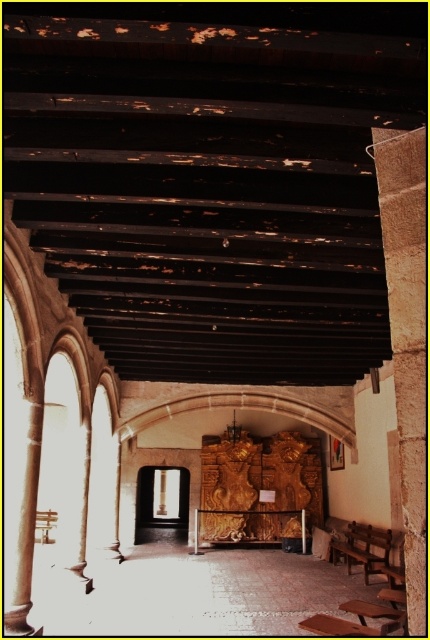
You are a visitor in this historical building and want to sit on the wooden bench at center. Which direction should you walk from the brown stone pillar at right to reach it?

The brown stone pillar at right is positioned on the left side of wooden bench at center, so you should walk to the right from the brown stone pillar at right to reach the wooden bench at center.

You are a visitor standing at the entrance of the historical building. You see two wooden benches. One is the wooden bench at center and the other is the wooden bench at lower right. Which bench is positioned higher in the image?

The wooden bench at center is positioned higher than the wooden bench at lower right.

You are a visitor in this historical building and need to sit down. There are two wooden benches available. The wooden bench at center and the wooden bench at lower right. Which one can accommodate more people?

The wooden bench at lower right is larger than the wooden bench at center, so it can accommodate more people.